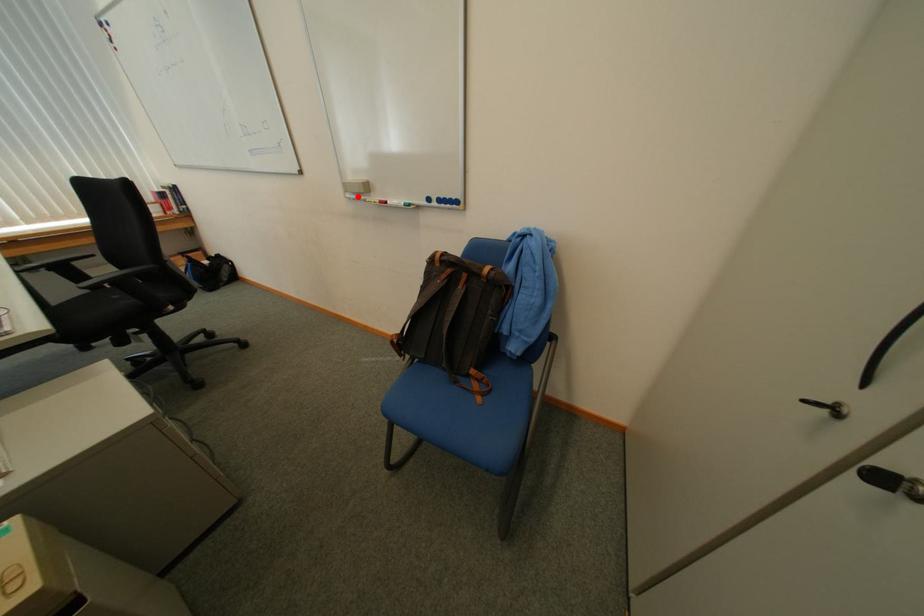
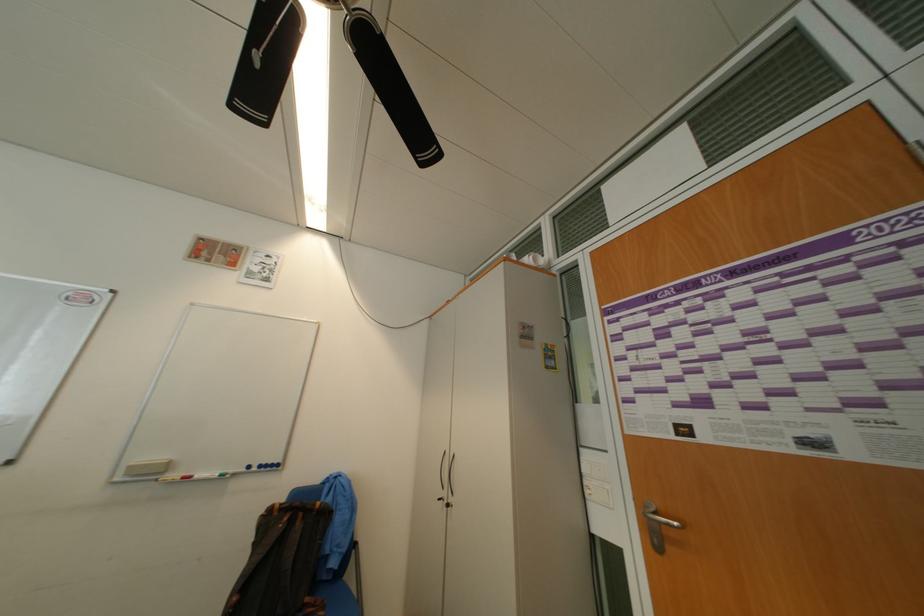
The point at the highlighted location is marked in the first image. Where is the corresponding point in the second image?

(128, 480)